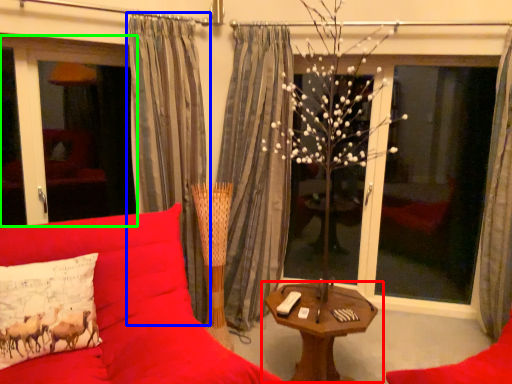
Question: Which object is positioned farthest from table (highlighted by a red box)? Select from curtain (highlighted by a blue box) and window screen (highlighted by a green box).

Choices:
 (A) curtain
 (B) window screen

Answer: (B)